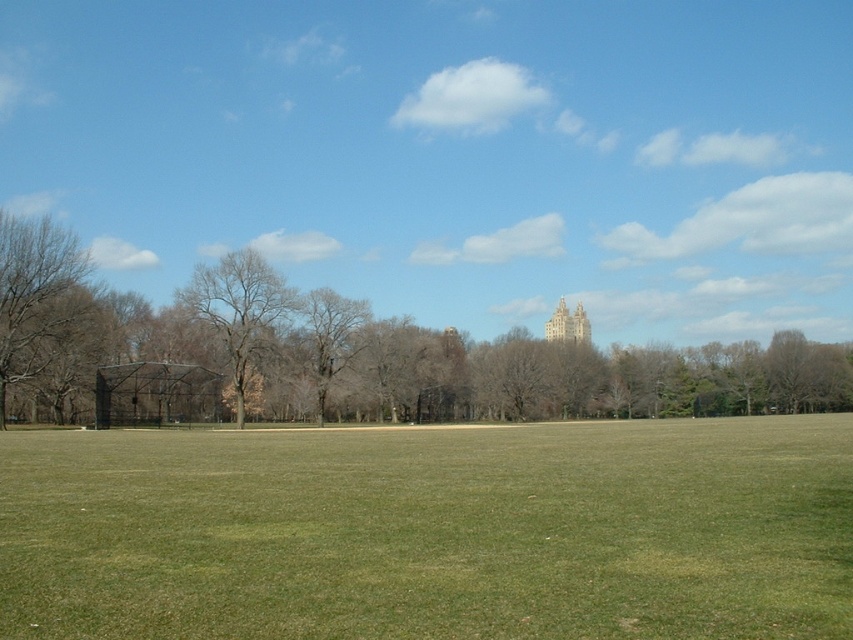
Is green grassy field at center thinner than bare branches at center?

In fact, green grassy field at center might be wider than bare branches at center.

Between point (239, 529) and point (234, 262), which one is positioned behind?

Positioned behind is point (234, 262).

Describe the element at coordinates (431, 531) in the screenshot. I see `green grassy field at center` at that location.

I want to click on green grassy field at center, so click(x=431, y=531).

Does point (573, 609) come behind point (357, 332)?

That is False.

You are a GUI agent. You are given a task and a screenshot of the screen. Output one action in this format:
    pyautogui.click(x=<x>, y=<y>)
    Task: Click on the green grassy field at center
    This screenshot has width=853, height=640.
    Given the screenshot: What is the action you would take?
    pyautogui.click(x=431, y=531)

Does point (709, 452) lie in front of point (563, 326)?

That is True.

Identify the location of green grassy field at center. This screenshot has width=853, height=640. (431, 531).

Describe the element at coordinates (431, 531) in the screenshot. I see `green grassy field at center` at that location.

Image resolution: width=853 pixels, height=640 pixels. Identify the location of green grassy field at center. (431, 531).